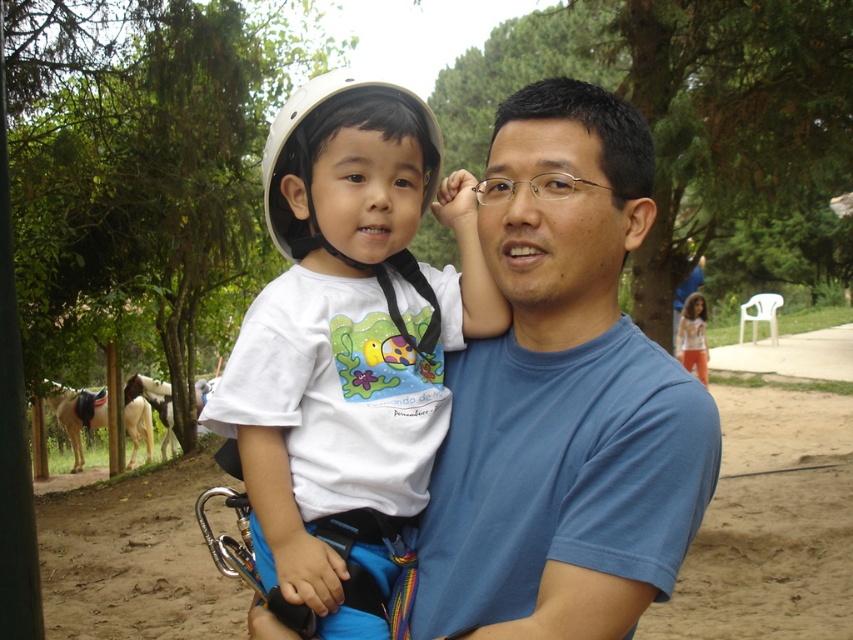
In the scene shown: You are a photographer trying to capture a closeup of the blue cotton shirt at center and the white matte helmet at upper center. Since you want both items to appear similarly sized in the photo, which object should you move closer to the camera?

The blue cotton shirt at center is wider than the white matte helmet at upper center. To make them appear similar in size in the photo, move the blue cotton shirt at center farther away from the camera while bringing the white matte helmet at upper center closer. Alternatively, adjust the camera lens to compensate for their size difference.

You are a photographer trying to capture the child wearing the white helmet with black straps. You notice a point at coordinates (349, 340) in your viewfinder. Based on the scene, can you determine if this point is part of the child or the adult?

The point at coordinates (349, 340) is on the white matte helmet at upper left, which is part of the child wearing the white helmet with black straps.

You are standing in the scene and want to take a photo of both the point at coordinates point (294, 481) and point (312, 84). Which point should you focus on first to ensure both are in focus?

You should focus on point (294, 481) first because it is closer to the camera than point (312, 84), ensuring both will be in focus when using a single focus point.